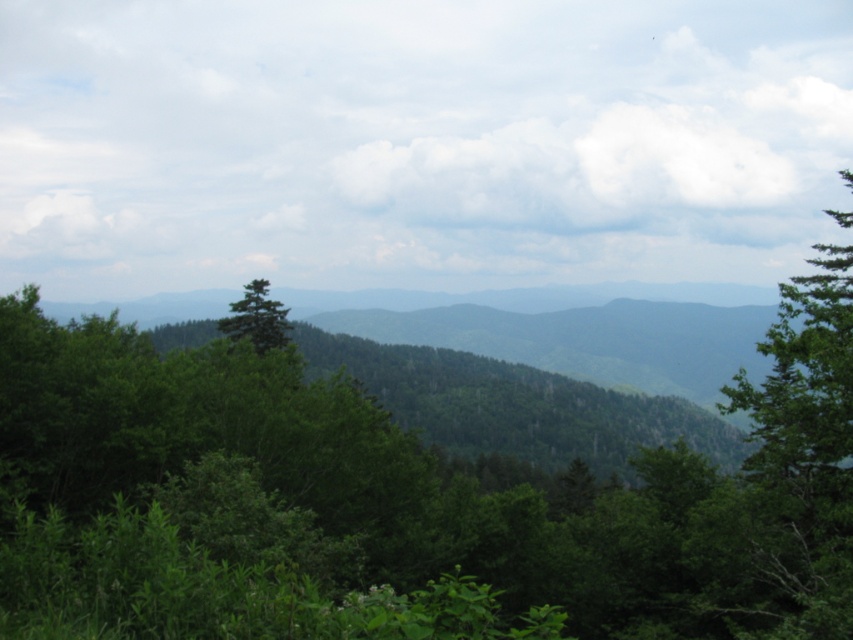
Question: Does green leafy tree at right have a larger size compared to green matte tree at center?

Choices:
 (A) yes
 (B) no

Answer: (A)

Question: Is green leafy tree at right positioned at the back of green matte tree at center?

Choices:
 (A) no
 (B) yes

Answer: (A)

Question: Among these points, which one is nearest to the camera?

Choices:
 (A) (846, 321)
 (B) (259, 291)

Answer: (A)

Question: Does green leafy tree at right have a greater width compared to green matte tree at center?

Choices:
 (A) yes
 (B) no

Answer: (A)

Question: Which object appears farthest from the camera in this image?

Choices:
 (A) green leafy tree at right
 (B) green matte tree at center

Answer: (B)

Question: Which point is closer to the camera?

Choices:
 (A) (804, 531)
 (B) (258, 310)

Answer: (A)